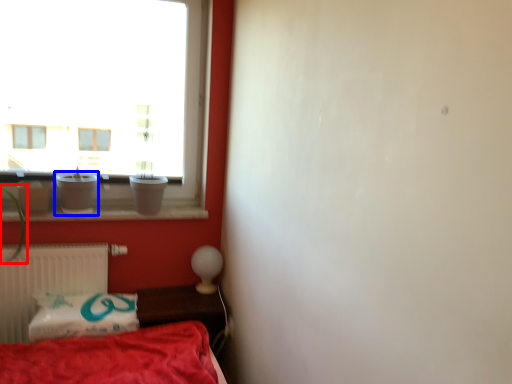
Question: Which object is further to the camera taking this photo, plant (highlighted by a red box) or glass vase (highlighted by a blue box)?

Choices:
 (A) plant
 (B) glass vase

Answer: (B)